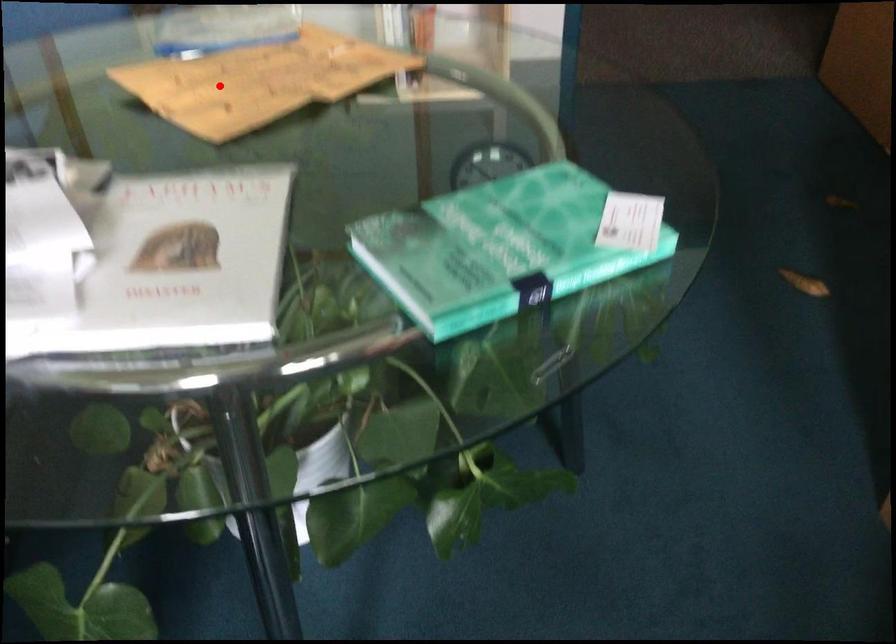
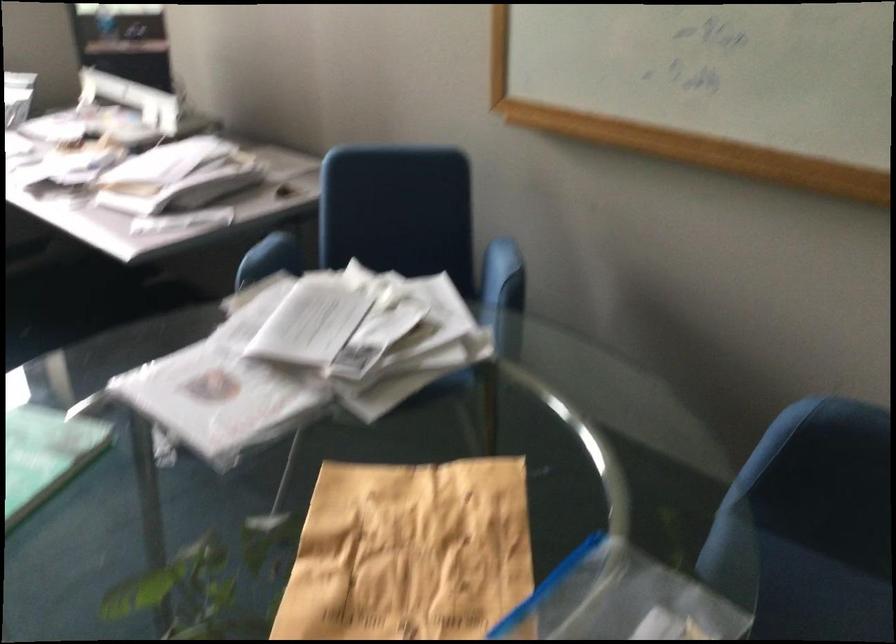
Find the pixel in the second image that matches the highlighted location in the first image.

(409, 552)